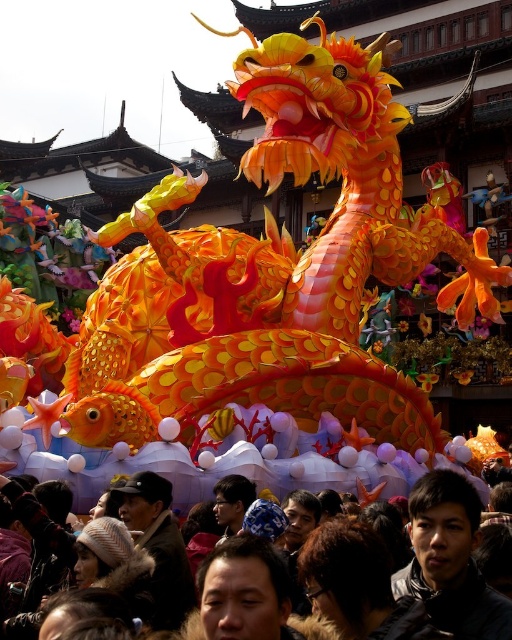
You are at a festive event and see a dark brown fur coat at lower center and a matte black jacket at lower right. Which item is covering the other?

The dark brown fur coat at lower center is positioned over matte black jacket at lower right, so it is covering the matte black jacket at lower right.

You are a guest at the festival and want to take a photo with the dragon lantern. You have a dark brown fur coat at lower center and a matte black jacket at lower right. Which clothing item is closer to the dragon lantern?

The dark brown fur coat at lower center is closer to the dragon lantern because it is in front of the matte black jacket at lower right.

In the scene shown: You are standing in the center of the festival scene and want to walk towards both the point at coordinates point (462, 483) and the point at coordinates point (509, 616). Which point will you reach first?

You will reach point (462, 483) first because it is closer to you than point (509, 616), which is further away.